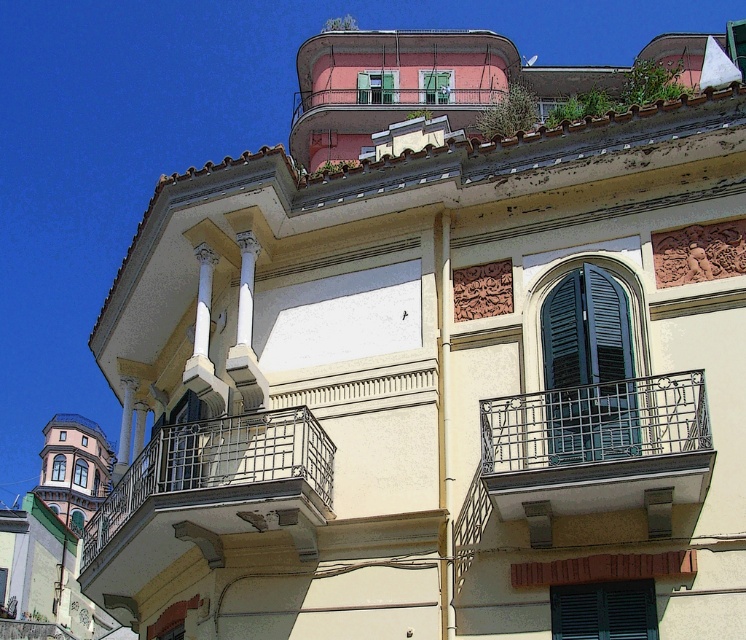
You are standing in front of a building with a Mediterranean style. You see a point marked at coordinates (x=586, y=369). What object is located at that point?

The point at (x=586, y=369) marks green matte shutters at center.

You are a window installer working on the building shown in the image. You need to install a new window at coordinate point 0.764, 0.286. Is there a silver metallic balcony at center in the way of this installation?

Yes, the silver metallic balcony at center is located exactly at the coordinate point (213, 488), so it will be in the way of the installation.

You are a painter standing at the base of the building and want to paint the black wrought iron balcony at center. Based on its 2D coordinates, is it located in the upper or lower half of the image?

The 2D coordinates of the black wrought iron balcony at center are at point [598,444]. Since the y coordinate is 0.802, which is above 0.5, it is located in the upper half of the image.